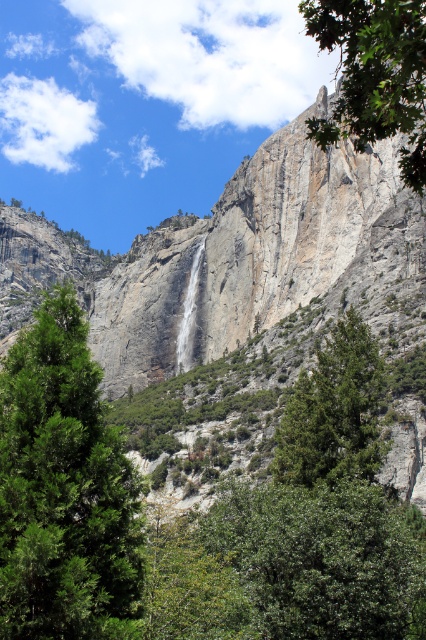
You are a hiker standing at the base of the cliff. You see the green leafy tree at upper right and the white smooth waterfall at center. Which object is higher up in the scene?

The green leafy tree at upper right is located above the white smooth waterfall at center, so it is higher up in the scene.

You are a hiker standing at the base of the cliff and want to cross from the green textured tree at center to the white smooth waterfall at center. Given that your hiking boots have a maximum grip suitable for paths up to 1 meter wide, will you be able to safely navigate the space between them?

The green textured tree at center is wider than the white smooth waterfall at center. Since the path between them may be narrower than 1 meter, your boots might not provide sufficient grip for safe passage.

You are a hiker who wants to cross from the green textured tree at center to the white smooth waterfall at center. Given that your average walking pace is 3 feet per second, how many seconds will it take you to reach the waterfall?

The distance between the green textured tree at center and the white smooth waterfall at center is 221.36 feet. At a pace of 3 feet per second, dividing the distance by the pace gives 221.36 divided by 3, which equals approximately 73.79 seconds. Rounding to the nearest whole number, it would take about 74 seconds to reach the waterfall.